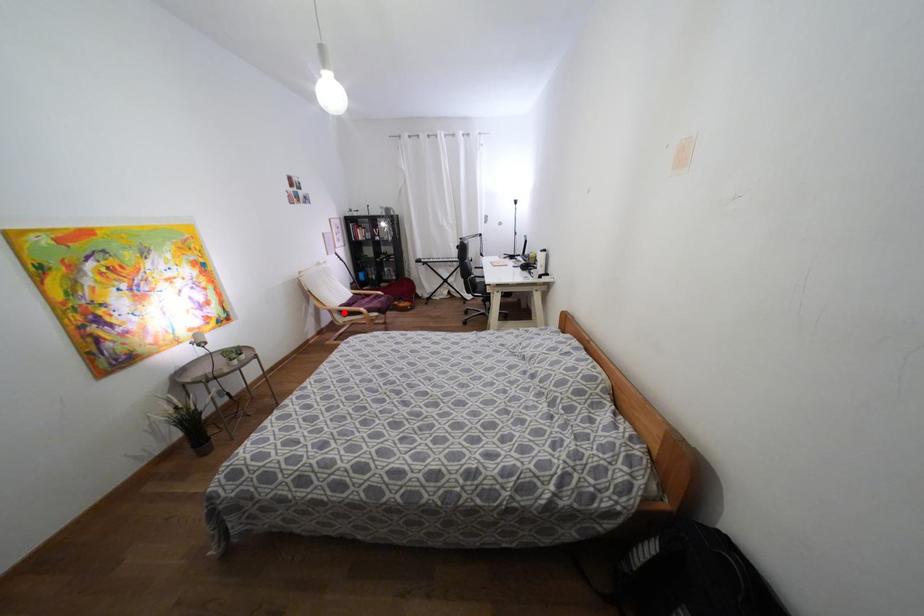
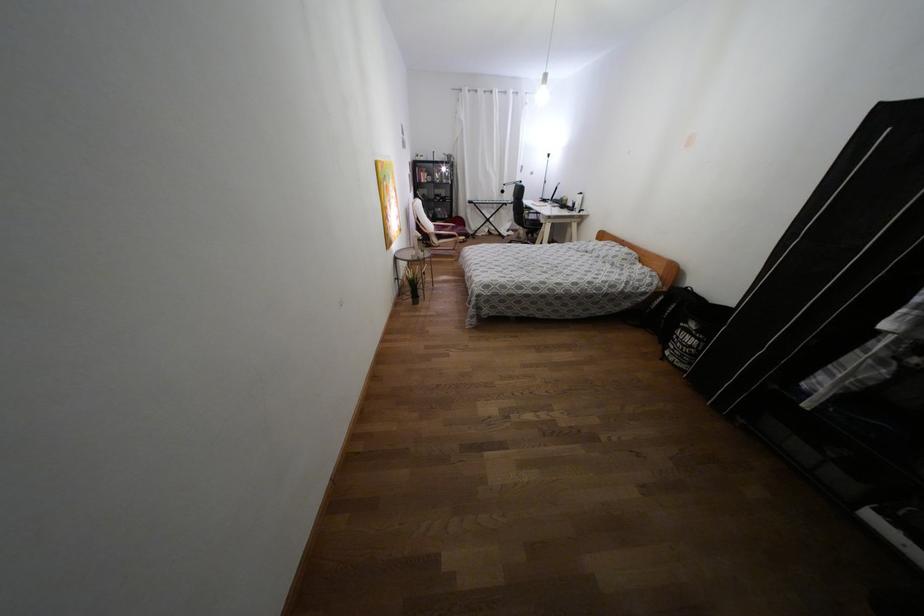
Question: I am providing you with two images of the same scene from different viewpoints. In image1, a red point is highlighted. Considering the same 3D point in image2, which of the following is correct?

Choices:
 (A) It is closer
 (B) It is farther

Answer: (A)